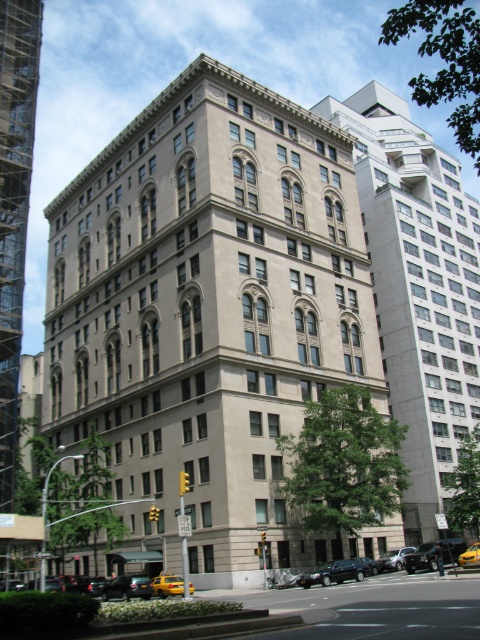
You are a pedestrian standing on the sidewalk near the traffic light. You want to cross the street to reach the entrance of the building. Which vehicle, the yellow rubber taxi at lower center or the shiny silver sedan at center, is closer to you?

The yellow rubber taxi at lower center is closer to you since it is in front of the shiny silver sedan at center, meaning it is positioned nearer to your location on the sidewalk.

You are standing on the sidewalk in front of the classical building. You notice two points marked on the building facade. The first is at coordinates point (165, 593) and the second is at point (400, 566). Which point is closer to you?

Point (165, 593) is closer to the viewer than point (400, 566).

You are a pedestrian standing on the sidewalk in front of the multi story building. You see a shiny black sedan represented by point (333,572). Is the shiny black sedan at lower center closer to the traffic light or to the parked cars?

The shiny black sedan at lower center is represented by point (333,572). Since the traffic light is near the corner and the parked cars are along the curb, the sedan is closer to the parked cars.